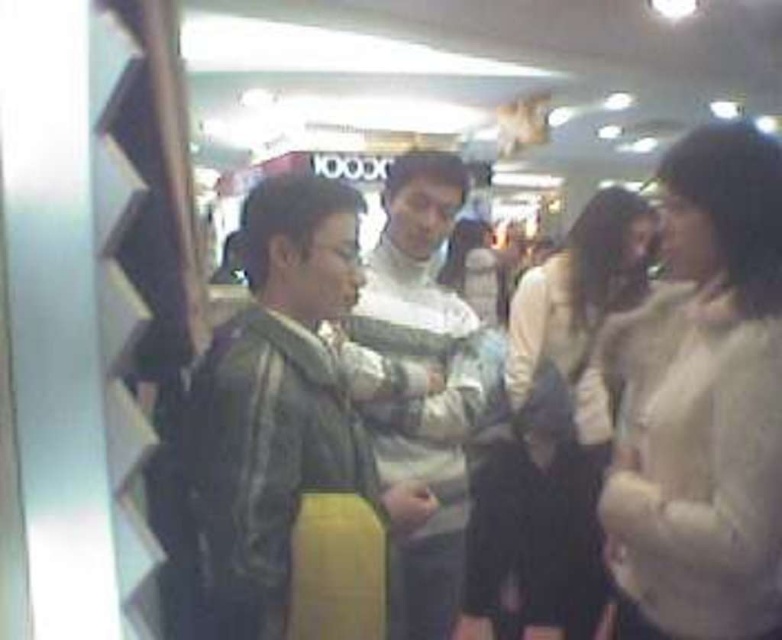
Question: Which of the following is the closest to the observer?

Choices:
 (A) leather jacket at center
 (B) camouflage jacket at center
 (C) white woolen sweater at center

Answer: (A)

Question: Estimate the real-world distances between objects in this image. Which object is farther from the white fuzzy sweater at right?

Choices:
 (A) camouflage jacket at center
 (B) leather jacket at center

Answer: (B)

Question: Does white fuzzy sweater at right appear under camouflage jacket at center?

Choices:
 (A) yes
 (B) no

Answer: (A)

Question: Can you confirm if white woolen sweater at center is positioned to the right of camouflage jacket at center?

Choices:
 (A) yes
 (B) no

Answer: (A)

Question: Which point is farther to the camera?

Choices:
 (A) leather jacket at center
 (B) white fuzzy sweater at right

Answer: (B)

Question: Is white fuzzy sweater at right wider than camouflage jacket at center?

Choices:
 (A) no
 (B) yes

Answer: (B)